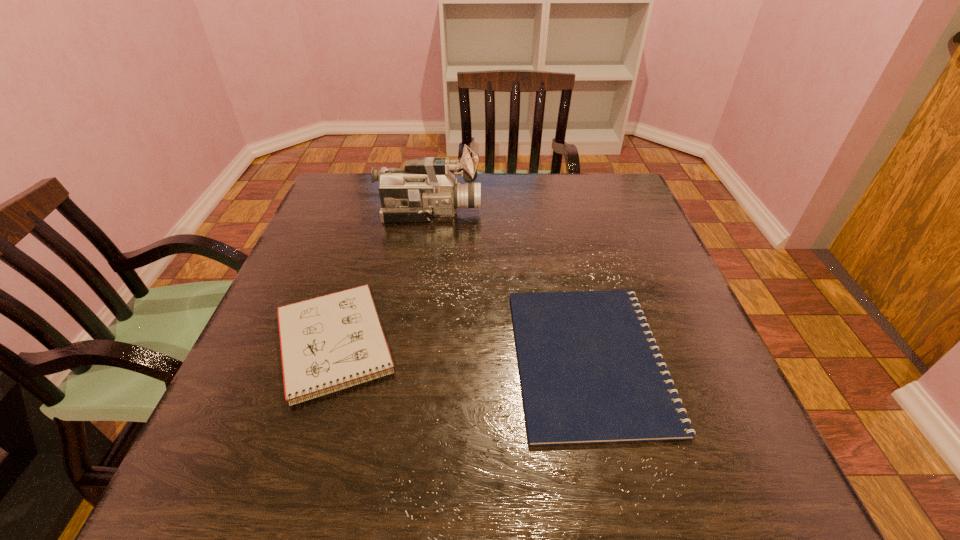
Where is `free space in the image that satisfies the following two spatial constraints: 1. on the front-facing side of the camcorder; 2. on the right side of the right notepad`? This screenshot has height=540, width=960. free space in the image that satisfies the following two spatial constraints: 1. on the front-facing side of the camcorder; 2. on the right side of the right notepad is located at coordinates (407, 358).

You are a GUI agent. You are given a task and a screenshot of the screen. Output one action in this format:
    pyautogui.click(x=<x>, y=<y>)
    Task: Click on the free space that satisfies the following two spatial constraints: 1. on the front-facing side of the farthest object; 2. on the left side of the shorter notepad
    
    Given the screenshot: What is the action you would take?
    pyautogui.click(x=407, y=358)

Locate an element on the screen. Image resolution: width=960 pixels, height=540 pixels. free space that satisfies the following two spatial constraints: 1. on the back side of the shortest object; 2. on the front-facing side of the camcorder is located at coordinates (556, 212).

Locate an element on the screen. This screenshot has height=540, width=960. vacant region that satisfies the following two spatial constraints: 1. on the front-facing side of the farthest object; 2. on the front side of the taller notepad is located at coordinates (409, 345).

Find the location of a particular element. The width and height of the screenshot is (960, 540). free space in the image that satisfies the following two spatial constraints: 1. on the front side of the right notepad; 2. on the right side of the taller notepad is located at coordinates (329, 358).

This screenshot has height=540, width=960. I want to click on free location that satisfies the following two spatial constraints: 1. on the front-facing side of the rightmost object; 2. on the right side of the farthest object, so click(x=407, y=358).

Locate an element on the screen. This screenshot has height=540, width=960. free space that satisfies the following two spatial constraints: 1. on the front-facing side of the farthest object; 2. on the back side of the right notepad is located at coordinates (x=407, y=358).

The width and height of the screenshot is (960, 540). What are the coordinates of `free space that satisfies the following two spatial constraints: 1. on the front-facing side of the tallest object; 2. on the back side of the rightmost object` in the screenshot? It's located at (407, 358).